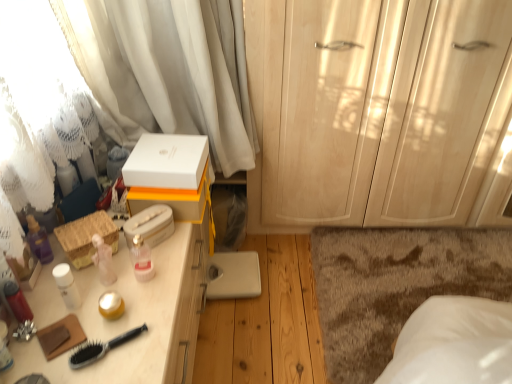
The image size is (512, 384). Find the location of `blank space to the left of black plastic brush at lower left`. blank space to the left of black plastic brush at lower left is located at coordinates (49, 334).